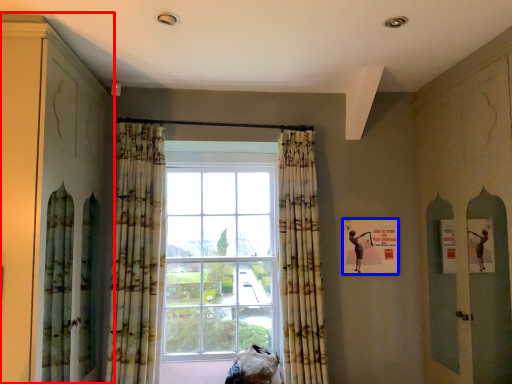
Question: Which object is further to the camera taking this photo, cabinetry (highlighted by a red box) or poster (highlighted by a blue box)?

Choices:
 (A) cabinetry
 (B) poster

Answer: (B)